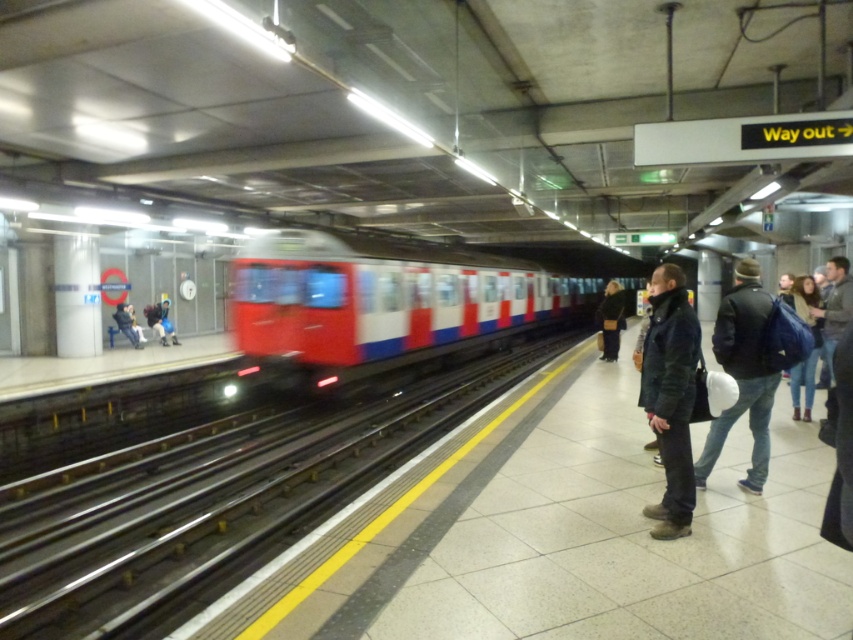
You are a delivery person carrying a 2.5 meter long box and need to place it on the platform floor. The box must be placed between the metallic train track at center and the dark blue jacket at right. Is there enough space for the box?

The metallic train track at center is 6.15 meters away from the dark blue jacket at right. Since the box is only 2.5 meters long, there is more than enough space between them to place the box.

You are a passenger waiting for the train at the subway station. You notice two people wearing jackets. One is wearing a dark green jacket at center and the other is wearing a dark blue jacket at right. Which jacket is smaller in size?

The dark green jacket at center is smaller than the dark blue jacket at right.

You are a delivery person carrying a large box that measures 3 feet wide. You are standing next to the dark brown leather jacket at center and need to walk to the denim jacket at right to deliver the box. Is there enough space between the two jackets for you to move through comfortably?

The distance between the denim jacket at right and the dark brown leather jacket at center is 30.36 feet. Since your box is only 3 feet wide, there is ample space for you to move through comfortably without any issues.